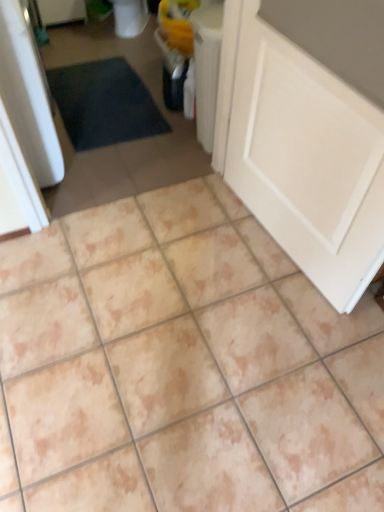
Identify the location of vacant area on top of beige ceramic tile at center (from a real-world perspective). This screenshot has width=384, height=512. (129, 207).